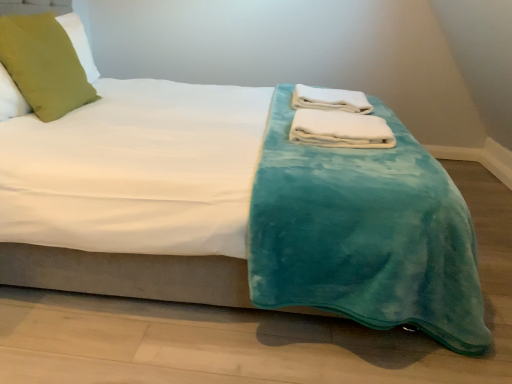
Find the location of `white soft towel at center, which appears as the 2th bath towel when viewed from the top`. white soft towel at center, which appears as the 2th bath towel when viewed from the top is located at coordinates (340, 129).

What do you see at coordinates (80, 44) in the screenshot?
I see `green fabric pillow at upper left` at bounding box center [80, 44].

Find the location of `white soft towel at center, positioned as the 1th bath towel in top-to-bottom order`. white soft towel at center, positioned as the 1th bath towel in top-to-bottom order is located at coordinates (330, 99).

Is white soft towel at center, the first bath towel positioned from the back, in front of or behind white soft towel at center, which is counted as the 2th bath towel, starting from the back, in the image?

white soft towel at center, the first bath towel positioned from the back, is behind white soft towel at center, which is counted as the 2th bath towel, starting from the back.

Is white soft towel at center, the first bath towel positioned from the back, oriented towards white soft towel at center, which is the 1th bath towel in bottom-to-top order?

No, white soft towel at center, the first bath towel positioned from the back, is not turned towards white soft towel at center, which is the 1th bath towel in bottom-to-top order.

Considering the relative sizes of white soft towel at center, the second bath towel from the front, and white soft towel at center, which is the 1th bath towel in bottom-to-top order, in the image provided, is white soft towel at center, the second bath towel from the front, smaller than white soft towel at center, which is the 1th bath towel in bottom-to-top order,?

Incorrect, white soft towel at center, the second bath towel from the front, is not smaller in size than white soft towel at center, which is the 1th bath towel in bottom-to-top order.

Between point (337, 101) and point (343, 127), which one is positioned in front?

The point (343, 127) is in front.

From a real-world perspective, which object stands above the other?

green fabric pillow at upper left, from a real-world perspective.

Which is behind, white soft towel at center, which is counted as the 2th bath towel, starting from the back, or green fabric pillow at upper left?

green fabric pillow at upper left is further from the camera.

Are white soft towel at center, which is the 1th bath towel in bottom-to-top order, and green fabric pillow at upper left far apart?

Absolutely, white soft towel at center, which is the 1th bath towel in bottom-to-top order, is distant from green fabric pillow at upper left.

Is green fabric pillow at upper left not inside white soft towel at center, which appears as the 2th bath towel when viewed from the top?

Absolutely, green fabric pillow at upper left is external to white soft towel at center, which appears as the 2th bath towel when viewed from the top.

This screenshot has height=384, width=512. In order to click on pillow lying above the white soft towel at center, which is counted as the 2th bath towel, starting from the back (from the image's perspective) in this screenshot , I will do `click(80, 44)`.

From the image's perspective, who appears lower, green fabric pillow at upper left or white soft towel at center, which is the 1th bath towel in bottom-to-top order?

white soft towel at center, which is the 1th bath towel in bottom-to-top order.

Considering the positions of objects green fabric pillow at upper left and white soft towel at center, which is counted as the 2th bath towel, starting from the back, in the image provided, who is behind, green fabric pillow at upper left or white soft towel at center, which is counted as the 2th bath towel, starting from the back,?

green fabric pillow at upper left is further from the camera.

How many degrees apart are the facing directions of white soft towel at center, the first bath towel positioned from the back, and green fabric pillow at upper left?

3.41 degrees separate the facing orientations of white soft towel at center, the first bath towel positioned from the back, and green fabric pillow at upper left.

From the image's perspective, is white soft towel at center, the first bath towel positioned from the back, located beneath green fabric pillow at upper left?

Yes.

Which point is more forward, (354, 96) or (6, 98)?

Point (6, 98)

From the picture: Does white soft towel at center, the first bath towel positioned from the back, lie behind green fabric pillow at upper left?

Yes.

Considering the positions of objects green fabric pillow at upper left and white soft towel at center, the second bath towel from the front, in the image provided, who is more to the right, green fabric pillow at upper left or white soft towel at center, the second bath towel from the front,?

white soft towel at center, the second bath towel from the front, is more to the right.

What's the angular difference between green fabric pillow at upper left and white soft towel at center, the second bath towel from the front,'s facing directions?

3.41 degrees separate the facing orientations of green fabric pillow at upper left and white soft towel at center, the second bath towel from the front.

From the image's perspective, which object appears higher, green fabric pillow at upper left or white soft towel at center, the second bath towel from the front?

green fabric pillow at upper left is shown above in the image.

Which of these two, green fabric pillow at upper left or white soft towel at center, the first bath towel positioned from the back, is bigger?

green fabric pillow at upper left.

Is white soft towel at center, the 2th bath towel positioned from the bottom, at the back of white soft towel at center, which is counted as the 2th bath towel, starting from the back?

That's not correct — white soft towel at center, which is counted as the 2th bath towel, starting from the back, is not looking away from white soft towel at center, the 2th bath towel positioned from the bottom.

You are a GUI agent. You are given a task and a screenshot of the screen. Output one action in this format:
    pyautogui.click(x=<x>, y=<y>)
    Task: Click on the bath towel to the right of white soft towel at center, which is counted as the 2th bath towel, starting from the back
    The width and height of the screenshot is (512, 384).
    Given the screenshot: What is the action you would take?
    pyautogui.click(x=330, y=99)

Does point (393, 142) come behind point (320, 90)?

No, it is in front of (320, 90).

From a real-world perspective, who is located higher, white soft towel at center, which appears as the 2th bath towel when viewed from the top, or white soft towel at center, the 2th bath towel positioned from the bottom?

In real-world perspective, white soft towel at center, the 2th bath towel positioned from the bottom, is above.

You are a GUI agent. You are given a task and a screenshot of the screen. Output one action in this format:
    pyautogui.click(x=<x>, y=<y>)
    Task: Click on the bath towel on the right of white soft towel at center, which appears as the 2th bath towel when viewed from the top
    This screenshot has width=512, height=384.
    Given the screenshot: What is the action you would take?
    pyautogui.click(x=330, y=99)

Find the location of a particular element. pillow to the left of white soft towel at center, which appears as the 2th bath towel when viewed from the top is located at coordinates coord(80,44).

Which object lies nearer to the anchor point green fabric pillow at upper left, white soft towel at center, positioned as the first bath towel in front-to-back order, or white soft towel at center, positioned as the 1th bath towel in top-to-bottom order?

Among the two, white soft towel at center, positioned as the 1th bath towel in top-to-bottom order, is located nearer to green fabric pillow at upper left.

Based on their spatial positions, is white soft towel at center, which is the 1th bath towel in bottom-to-top order, or green fabric pillow at upper left further from white soft towel at center, positioned as the 1th bath towel in top-to-bottom order?

Based on the image, green fabric pillow at upper left appears to be further to white soft towel at center, positioned as the 1th bath towel in top-to-bottom order.

Looking at the image, which one is located closer to white soft towel at center, the second bath towel from the front, green fabric pillow at upper left or white soft towel at center, which appears as the 2th bath towel when viewed from the top?

The object closer to white soft towel at center, the second bath towel from the front, is white soft towel at center, which appears as the 2th bath towel when viewed from the top.

Looking at the image, which one is located closer to white soft towel at center, which is the 1th bath towel in bottom-to-top order, green fabric pillow at upper left or white soft towel at center, the 2th bath towel positioned from the bottom?

The object closer to white soft towel at center, which is the 1th bath towel in bottom-to-top order, is white soft towel at center, the 2th bath towel positioned from the bottom.

Based on their spatial positions, is white soft towel at center, the first bath towel positioned from the back, or green fabric pillow at upper left further from white soft towel at center, positioned as the first bath towel in front-to-back order?

green fabric pillow at upper left.

From the image, which object appears to be nearer to green fabric pillow at upper left, white soft towel at center, positioned as the 1th bath towel in top-to-bottom order, or white soft towel at center, which is counted as the 2th bath towel, starting from the back?

Based on the image, white soft towel at center, positioned as the 1th bath towel in top-to-bottom order, appears to be nearer to green fabric pillow at upper left.

Identify the location of bath towel situated between green fabric pillow at upper left and white soft towel at center, positioned as the 1th bath towel in top-to-bottom order, from left to right. (340, 129).